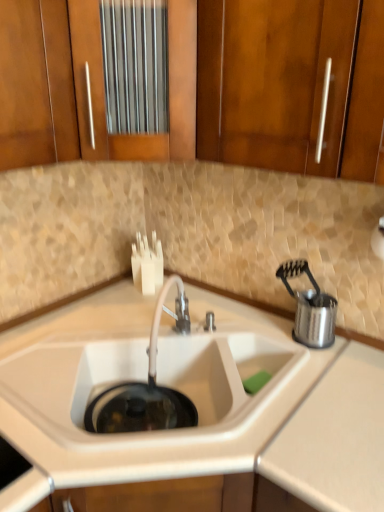
Identify the location of vacant area located to the right-hand side of satin nickel faucet at center. The height and width of the screenshot is (512, 384). (228, 348).